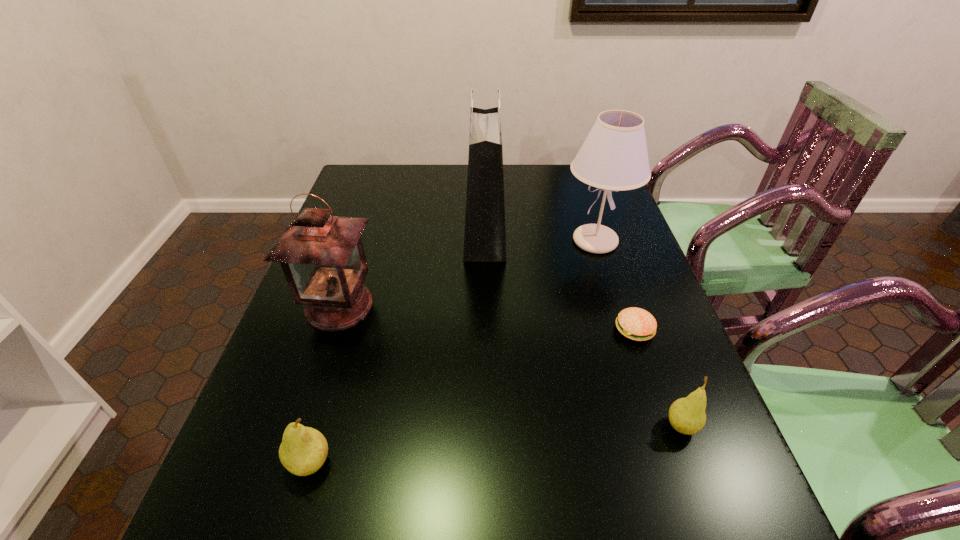
This screenshot has height=540, width=960. I want to click on patty located at the right edge, so click(637, 324).

This screenshot has width=960, height=540. In order to click on object that is at the near left corner in this screenshot , I will do `click(303, 450)`.

Where is `object at the near right corner`? The width and height of the screenshot is (960, 540). object at the near right corner is located at coordinates (687, 415).

The image size is (960, 540). What are the coordinates of `vacant space at the far edge of the desktop` in the screenshot? It's located at (399, 176).

Find the location of a particular element. This screenshot has height=540, width=960. free space at the near edge of the desktop is located at coordinates (351, 458).

Locate an element on the screen. The image size is (960, 540). free space at the left edge of the desktop is located at coordinates (264, 425).

Where is `blank space at the right edge`? The width and height of the screenshot is (960, 540). blank space at the right edge is located at coordinates (645, 372).

I want to click on free space at the far left corner of the desktop, so click(385, 181).

Find the location of a particular element. Image resolution: width=960 pixels, height=540 pixels. free space between the shopping bag and the fourth tallest object is located at coordinates (397, 348).

Find the location of a particular element. blank region between the left pear and the fourth object from right to left is located at coordinates (397, 348).